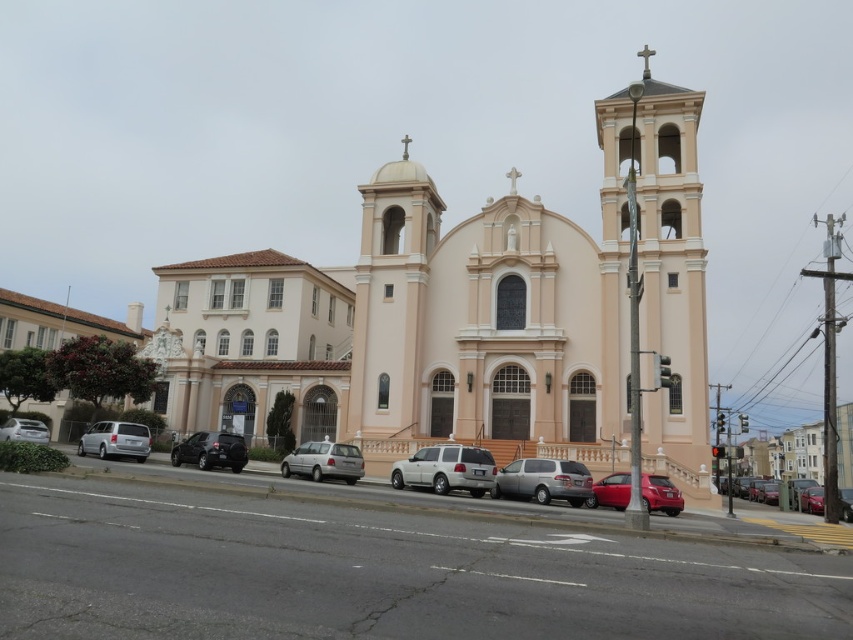
The width and height of the screenshot is (853, 640). What do you see at coordinates (323, 461) in the screenshot?
I see `silver metallic van at center` at bounding box center [323, 461].

Who is higher up, silver metallic van at center or metallic red car at lower right?

Positioned higher is silver metallic van at center.

This screenshot has height=640, width=853. Find the location of `silver metallic van at center`. silver metallic van at center is located at coordinates (323, 461).

You are a GUI agent. You are given a task and a screenshot of the screen. Output one action in this format:
    pyautogui.click(x=<x>, y=<y>)
    Task: Click on the silver metallic van at center
    This screenshot has height=640, width=853.
    Given the screenshot: What is the action you would take?
    pyautogui.click(x=323, y=461)

Can you confirm if metallic red car at lower right is positioned to the left of shiny black sedan at lower left?

In fact, metallic red car at lower right is to the right of shiny black sedan at lower left.

Does point (669, 500) come in front of point (236, 438)?

Yes, point (669, 500) is in front of point (236, 438).

Find the location of a particular element. The image size is (853, 640). metallic red car at lower right is located at coordinates (660, 493).

Is pink stucco church at center further to the viewer compared to silver metallic sedan at lower left?

No, it is in front of silver metallic sedan at lower left.

Which is behind, point (646, 61) or point (4, 432)?

The point (646, 61) is more distant.

Image resolution: width=853 pixels, height=640 pixels. What do you see at coordinates (467, 316) in the screenshot?
I see `pink stucco church at center` at bounding box center [467, 316].

Identify the location of pink stucco church at center. Image resolution: width=853 pixels, height=640 pixels. (467, 316).